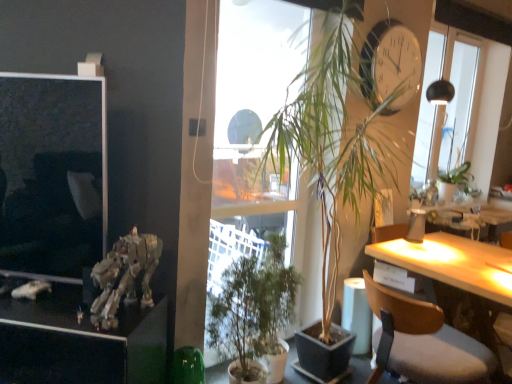
Image resolution: width=512 pixels, height=384 pixels. Find the location of `vacant space positioned to the left of metallic gold skeleton at lower left`. vacant space positioned to the left of metallic gold skeleton at lower left is located at coordinates (54, 312).